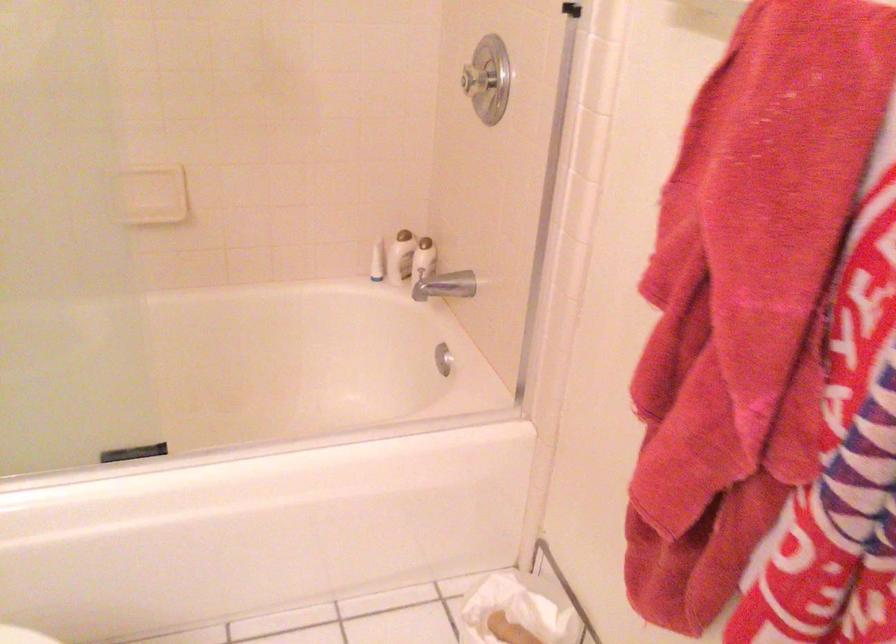
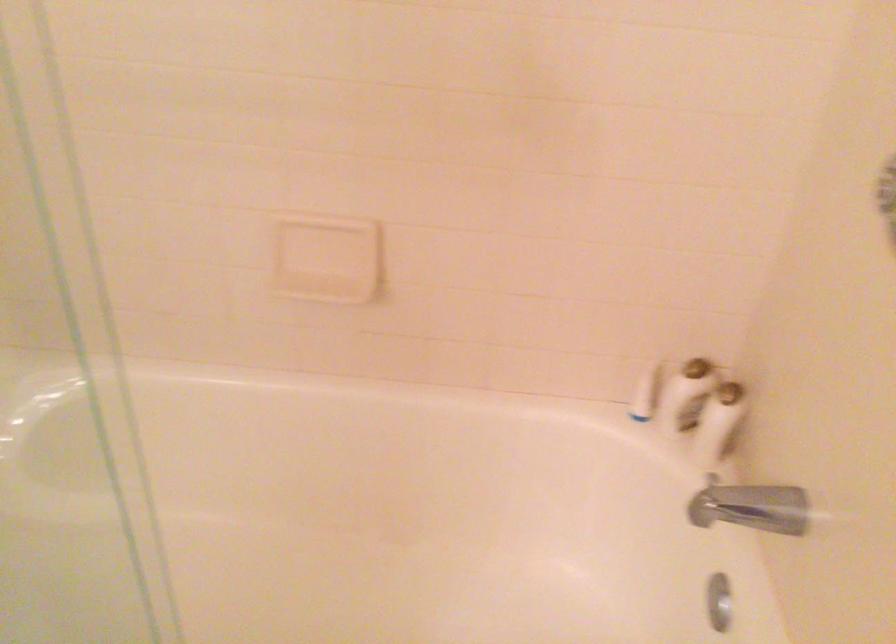
Question: The images are taken continuously from a first-person perspective. In which direction are you moving?

Choices:
 (A) Left
 (B) Right
 (C) Forward
 (D) Backward

Answer: (C)